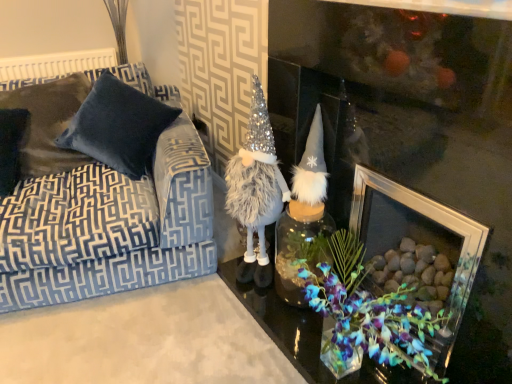
Find the location of a particular element. velvet pillow at left, positioned as the 2th pillow in right-to-left order is located at coordinates (11, 147).

You are a GUI agent. You are given a task and a screenshot of the screen. Output one action in this format:
    pyautogui.click(x=<x>, y=<y>)
    Task: Click on the velvet dark blue pillow at left, which appears as the 2th pillow when viewed from the left
    
    Given the screenshot: What is the action you would take?
    pyautogui.click(x=118, y=126)

At what (x,y) coordinates should I click in order to perform the action: click on the 2nd pillow to the left of the translucent glass jar at center, counting from the anchor's position. Please return your answer as a coordinate pair (x, y). The width and height of the screenshot is (512, 384). Looking at the image, I should click on (11, 147).

In the scene shown: Is translucent glass jar at center taller or shorter than velvet pillow at left, which is the 1th pillow in left-to-right order?

translucent glass jar at center is shorter than velvet pillow at left, which is the 1th pillow in left-to-right order.

From the image's perspective, is translucent glass jar at center located above or below velvet pillow at left, positioned as the 2th pillow in right-to-left order?

Clearly, from the image's perspective, translucent glass jar at center is below velvet pillow at left, positioned as the 2th pillow in right-to-left order.

Measure the distance between translucent glass jar at center and velvet pillow at left, positioned as the 2th pillow in right-to-left order.

translucent glass jar at center is 1.27 meters away from velvet pillow at left, positioned as the 2th pillow in right-to-left order.

Considering the relative positions of velvet blue couch at left and translucent glass jar at center in the image provided, is velvet blue couch at left to the left of translucent glass jar at center from the viewer's perspective?

Correct, you'll find velvet blue couch at left to the left of translucent glass jar at center.

Where is `studio couch above the translucent glass jar at center (from a real-world perspective)`? studio couch above the translucent glass jar at center (from a real-world perspective) is located at coordinates (99, 210).

Is velvet blue couch at left next to translucent glass jar at center and touching it?

They are not placed beside each other.

Does fuzzy silver/grey gnome at center come behind velvet dark blue pillow at left, the first pillow positioned from the right?

No, the depth of fuzzy silver/grey gnome at center is less than that of velvet dark blue pillow at left, the first pillow positioned from the right.

Which point is more distant from viewer, [239,213] or [84,146]?

The point [84,146] is more distant.

Is fuzzy silver/grey gnome at center oriented away from velvet dark blue pillow at left, which appears as the 2th pillow when viewed from the left?

No, fuzzy silver/grey gnome at center is not facing the opposite direction of velvet dark blue pillow at left, which appears as the 2th pillow when viewed from the left.

Looking at their sizes, would you say velvet pillow at left, positioned as the 2th pillow in right-to-left order, is wider or thinner than clear glass picture frame at center?

velvet pillow at left, positioned as the 2th pillow in right-to-left order, is thinner than clear glass picture frame at center.

Is velvet pillow at left, positioned as the 2th pillow in right-to-left order, not inside clear glass picture frame at center?

Yes, velvet pillow at left, positioned as the 2th pillow in right-to-left order, is outside of clear glass picture frame at center.

Is velvet pillow at left, which is the 1th pillow in left-to-right order, placed right next to clear glass picture frame at center?

No, velvet pillow at left, which is the 1th pillow in left-to-right order, is not beside clear glass picture frame at center.

The image size is (512, 384). What are the coordinates of `studio couch to the right of velvet pillow at left, positioned as the 2th pillow in right-to-left order` in the screenshot? It's located at (99, 210).

Does point (209, 268) lie in front of point (11, 131)?

Yes, it is.

Consider the image. From the image's perspective, is velvet blue couch at left located above velvet pillow at left, which is the 1th pillow in left-to-right order?

No.

Is velvet blue couch at left looking in the opposite direction of velvet pillow at left, which is the 1th pillow in left-to-right order?

That's right, velvet blue couch at left is facing away from velvet pillow at left, which is the 1th pillow in left-to-right order.

From a real-world perspective, which object rests below the other?

velvet pillow at left, which is the 1th pillow in left-to-right order.

Can you tell me how much velvet pillow at left, which is the 1th pillow in left-to-right order, and velvet dark blue pillow at left, the first pillow positioned from the right, differ in facing direction?

The angle between the facing direction of velvet pillow at left, which is the 1th pillow in left-to-right order, and the facing direction of velvet dark blue pillow at left, the first pillow positioned from the right, is 0.00148 degrees.

Considering the sizes of objects velvet pillow at left, positioned as the 2th pillow in right-to-left order, and velvet dark blue pillow at left, which appears as the 2th pillow when viewed from the left, in the image provided, who is taller, velvet pillow at left, positioned as the 2th pillow in right-to-left order, or velvet dark blue pillow at left, which appears as the 2th pillow when viewed from the left,?

velvet dark blue pillow at left, which appears as the 2th pillow when viewed from the left.

Does velvet pillow at left, which is the 1th pillow in left-to-right order, contain velvet dark blue pillow at left, the first pillow positioned from the right?

Actually, velvet dark blue pillow at left, the first pillow positioned from the right, is outside velvet pillow at left, which is the 1th pillow in left-to-right order.

From a real-world perspective, is velvet pillow at left, which is the 1th pillow in left-to-right order, positioned over velvet blue couch at left based on gravity?

Indeed, from a real-world perspective, velvet pillow at left, which is the 1th pillow in left-to-right order, stands above velvet blue couch at left.

Is velvet pillow at left, which is the 1th pillow in left-to-right order, thinner than velvet blue couch at left?

Yes, velvet pillow at left, which is the 1th pillow in left-to-right order, is thinner than velvet blue couch at left.

Does point (7, 130) come in front of point (4, 202)?

No, it is not.

Is velvet pillow at left, which is the 1th pillow in left-to-right order, closer to the viewer compared to velvet blue couch at left?

No, velvet pillow at left, which is the 1th pillow in left-to-right order, is further to the viewer.

From the translucent glass jar at center, count the 2nd pillow to the left and point to it. Please provide its 2D coordinates.

[(11, 147)]

I want to click on glass vase located behind the velvet blue couch at left, so click(x=300, y=247).

Considering their positions, is velvet dark blue pillow at left, which appears as the 2th pillow when viewed from the left, positioned closer to translucent glass jar at center than velvet pillow at left, which is the 1th pillow in left-to-right order?

Based on the image, velvet dark blue pillow at left, which appears as the 2th pillow when viewed from the left, appears to be nearer to translucent glass jar at center.

Based on their spatial positions, is fuzzy silver/grey gnome at center or velvet blue couch at left closer to translucent glass jar at center?

fuzzy silver/grey gnome at center.

Which object lies nearer to the anchor point velvet blue couch at left, fuzzy silver/grey gnome at center or translucent glass jar at center?

fuzzy silver/grey gnome at center is positioned closer to the anchor velvet blue couch at left.

Estimate the real-world distances between objects in this image. Which object is further from clear glass picture frame at center, velvet blue couch at left or velvet dark blue pillow at left, the first pillow positioned from the right?

The object further to clear glass picture frame at center is velvet dark blue pillow at left, the first pillow positioned from the right.

When comparing their distances from velvet blue couch at left, does translucent glass jar at center or clear glass picture frame at center seem further?

Among the two, clear glass picture frame at center is located further to velvet blue couch at left.

From the picture: Looking at the image, which one is located closer to clear glass picture frame at center, velvet pillow at left, which is the 1th pillow in left-to-right order, or velvet dark blue pillow at left, which appears as the 2th pillow when viewed from the left?

velvet dark blue pillow at left, which appears as the 2th pillow when viewed from the left, is closer to clear glass picture frame at center.

Which object lies nearer to the anchor point fuzzy silver/grey gnome at center, clear glass picture frame at center or velvet pillow at left, which is the 1th pillow in left-to-right order?

clear glass picture frame at center.

Based on their spatial positions, is velvet blue couch at left or velvet dark blue pillow at left, the first pillow positioned from the right, further from translucent glass jar at center?

velvet dark blue pillow at left, the first pillow positioned from the right, is positioned further to the anchor translucent glass jar at center.

Where is `pillow situated between velvet pillow at left, which is the 1th pillow in left-to-right order, and translucent glass jar at center from left to right`? The image size is (512, 384). pillow situated between velvet pillow at left, which is the 1th pillow in left-to-right order, and translucent glass jar at center from left to right is located at coordinates (118, 126).

The height and width of the screenshot is (384, 512). I want to click on pillow located between velvet pillow at left, which is the 1th pillow in left-to-right order, and fuzzy silver/grey gnome at center in the left-right direction, so click(118, 126).

Identify the location of studio couch between velvet pillow at left, which is the 1th pillow in left-to-right order, and translucent glass jar at center from left to right. (99, 210).

Where is `figurine situated between velvet dark blue pillow at left, which appears as the 2th pillow when viewed from the left, and clear glass picture frame at center from left to right`? Image resolution: width=512 pixels, height=384 pixels. figurine situated between velvet dark blue pillow at left, which appears as the 2th pillow when viewed from the left, and clear glass picture frame at center from left to right is located at coordinates (256, 189).